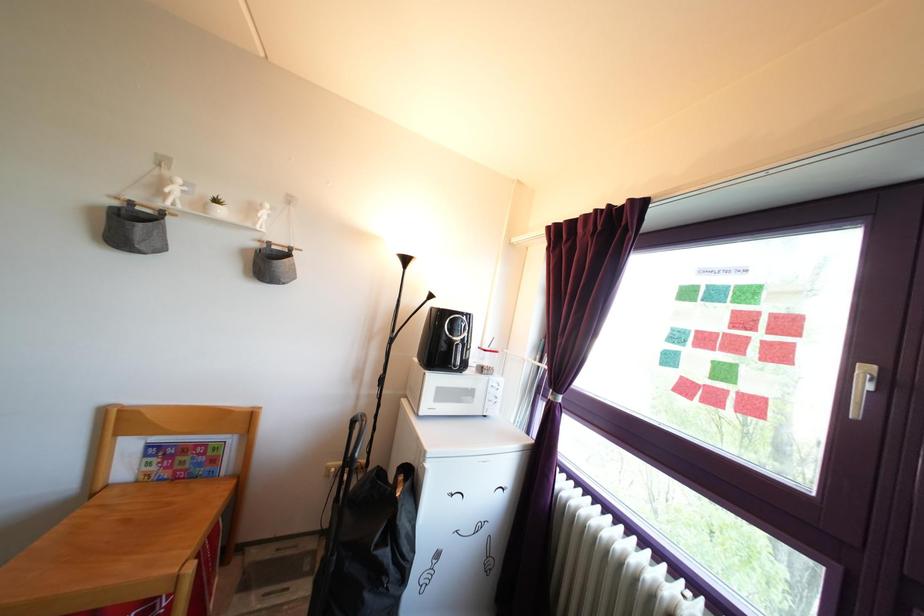
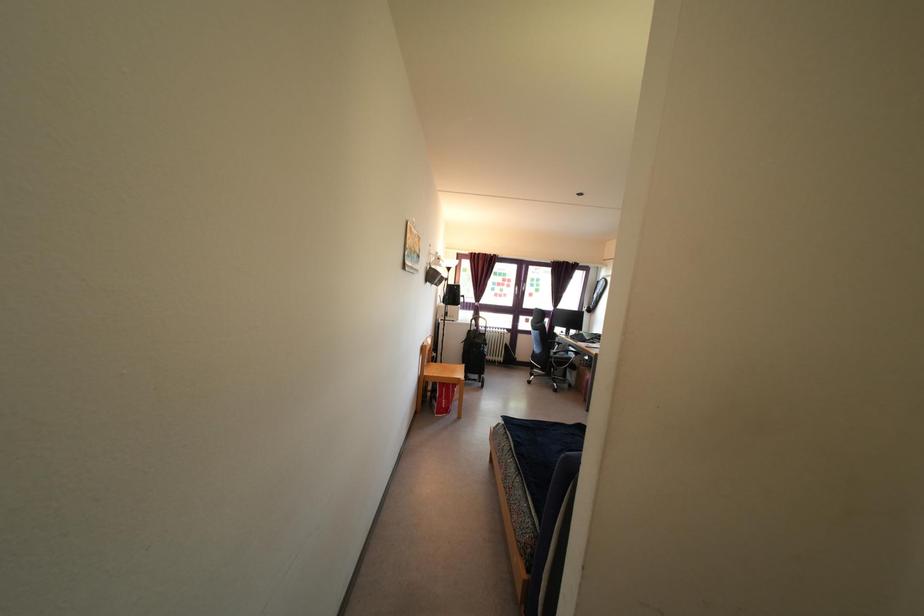
Question: I am providing you with two images of the same scene from different viewpoints. After the viewpoint changes to image2, which objects are now occluded?

Choices:
 (A) sofa sitting surface
 (B) chair sitting surface
 (C) small white pot
 (D) white slipper

Answer: (C)